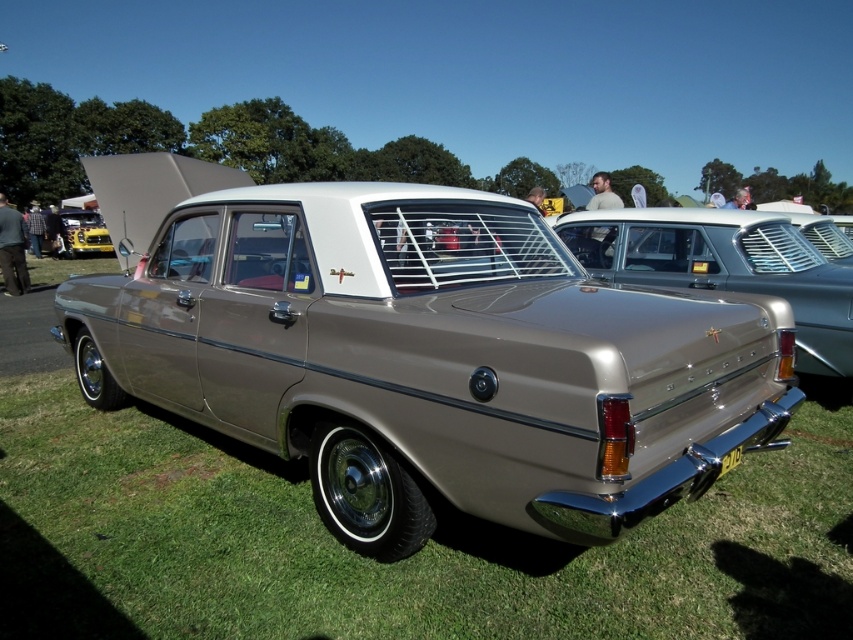
Question: Is metallic gold car at center positioned behind yellow metallic car at left?

Choices:
 (A) yes
 (B) no

Answer: (B)

Question: Which point is farther to the camera?

Choices:
 (A) [70, 250]
 (B) [129, 394]

Answer: (A)

Question: Does metallic gold car at center have a smaller size compared to yellow metallic car at left?

Choices:
 (A) no
 (B) yes

Answer: (A)

Question: Which object appears farthest from the camera in this image?

Choices:
 (A) yellow metallic car at left
 (B) metallic gold car at center

Answer: (A)

Question: Which object appears farthest from the camera in this image?

Choices:
 (A) metallic gold car at center
 (B) yellow metallic car at left

Answer: (B)

Question: Is metallic gold car at center bigger than yellow metallic car at left?

Choices:
 (A) yes
 (B) no

Answer: (A)